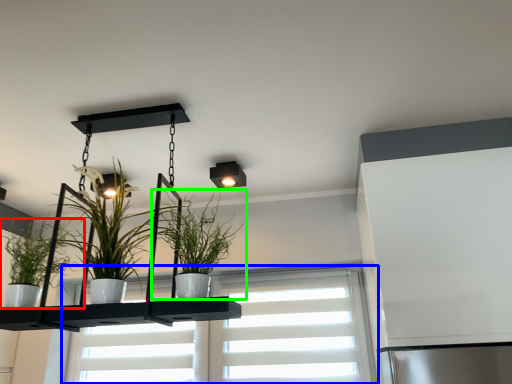
Question: Estimate the real-world distances between objects in this image. Which object is closer to houseplant (highlighted by a red box), window (highlighted by a blue box) or houseplant (highlighted by a green box)?

Choices:
 (A) window
 (B) houseplant

Answer: (B)